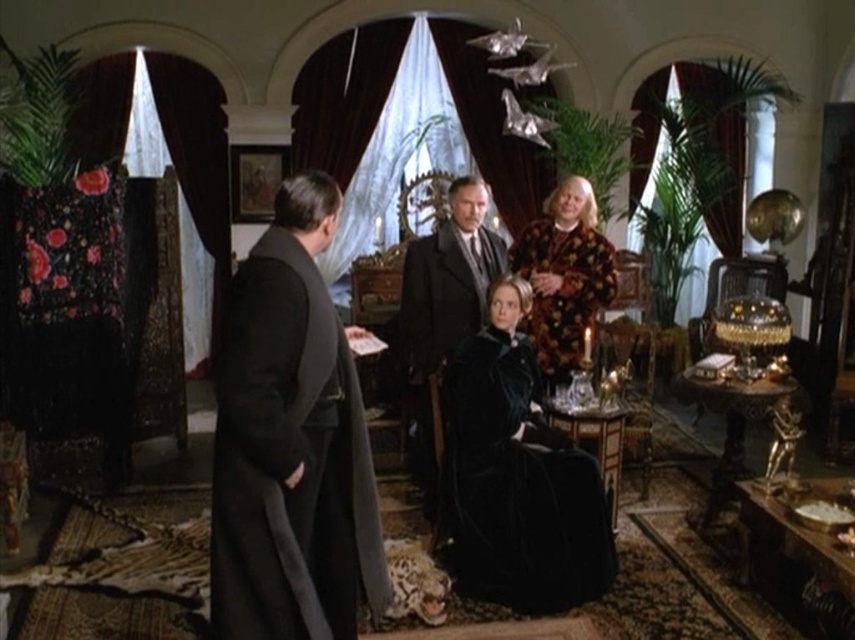
Question: Which point appears closest to the camera in this image?

Choices:
 (A) (516, 266)
 (B) (355, 492)
 (C) (323, 356)
 (D) (582, 548)

Answer: (C)

Question: Does black velvet robe at center appear on the right side of fluffy brown coat at center?

Choices:
 (A) yes
 (B) no

Answer: (B)

Question: Can you confirm if velvet black robe at left is thinner than fluffy brown coat at center?

Choices:
 (A) yes
 (B) no

Answer: (A)

Question: Which point is closer to the camera?

Choices:
 (A) (478, 236)
 (B) (332, 486)
 (C) (508, 499)
 (D) (345, 573)

Answer: (B)

Question: Is velvet robe at center thinner than black velvet robe at center?

Choices:
 (A) yes
 (B) no

Answer: (A)

Question: Which of these objects is positioned closest to the velvet robe at center?

Choices:
 (A) velvet black coat at center
 (B) velvet black robe at left
 (C) fluffy brown coat at center

Answer: (B)